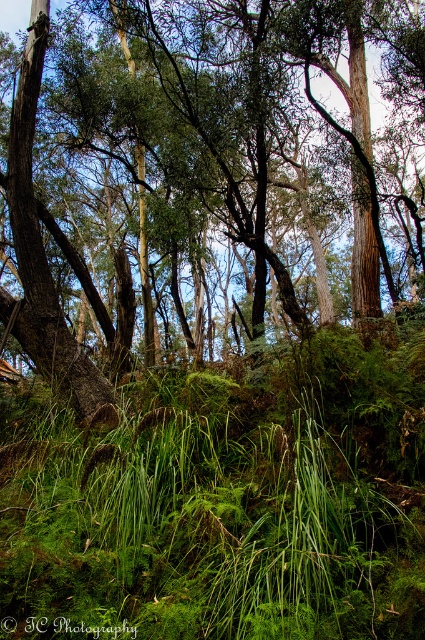
Question: Is the position of green leafy tree at center more distant than that of green leafy grass at center?

Choices:
 (A) yes
 (B) no

Answer: (A)

Question: Is green leafy tree at center to the right of green leafy grass at center from the viewer's perspective?

Choices:
 (A) yes
 (B) no

Answer: (B)

Question: Which of the following is the closest to the observer?

Choices:
 (A) (308, 22)
 (B) (159, 520)

Answer: (B)

Question: Which point is closer to the camera?

Choices:
 (A) (343, 548)
 (B) (328, 148)

Answer: (A)

Question: In this image, where is green leafy tree at center located relative to green leafy grass at center?

Choices:
 (A) above
 (B) below

Answer: (A)